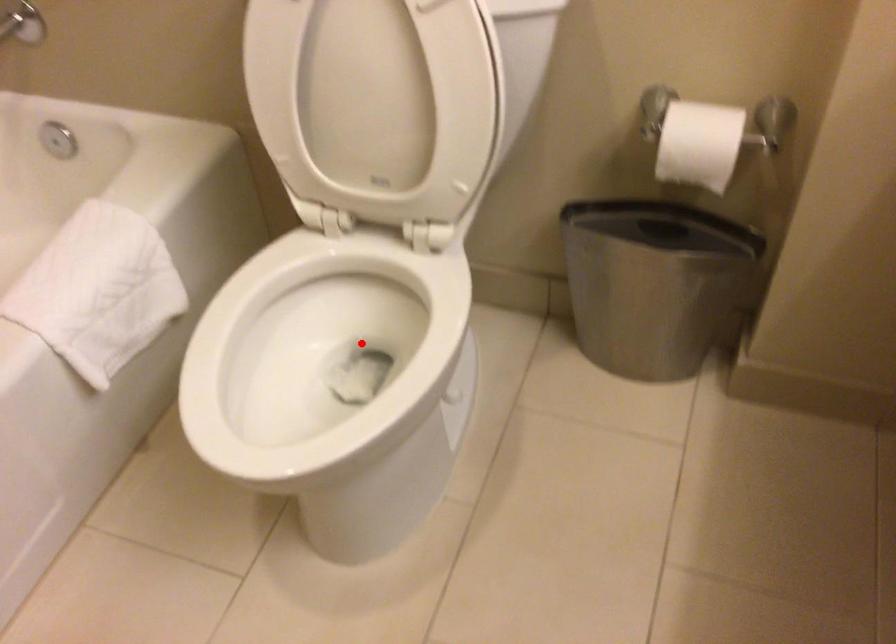
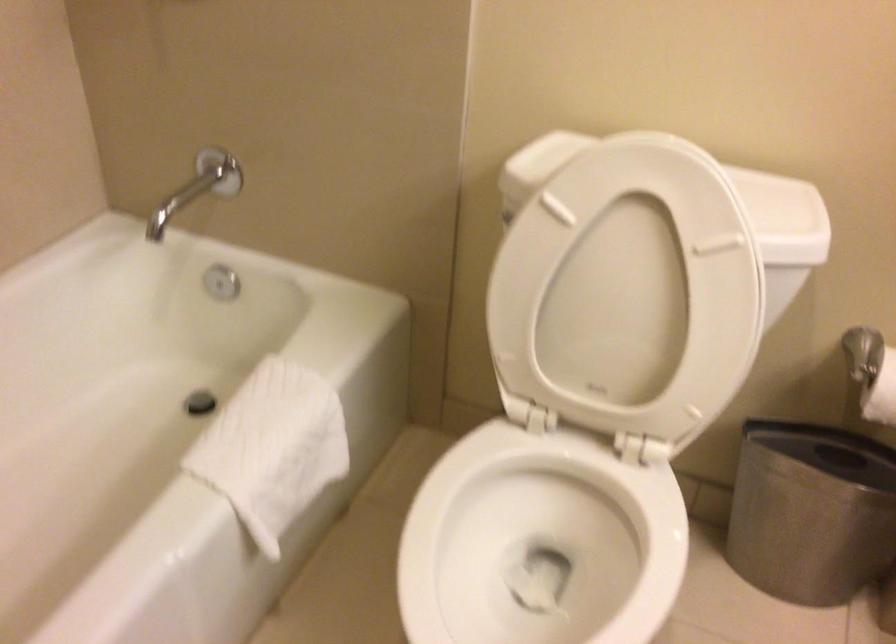
Locate, in the second image, the point that corresponds to the highlighted location in the first image.

(539, 542)